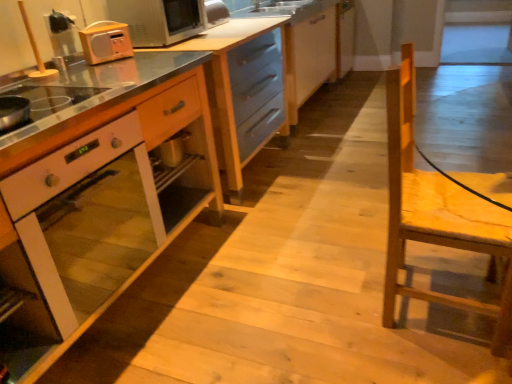
Identify the location of vacant area that lies between light brown wooden chair at right and white glossy oven at center. (270, 297).